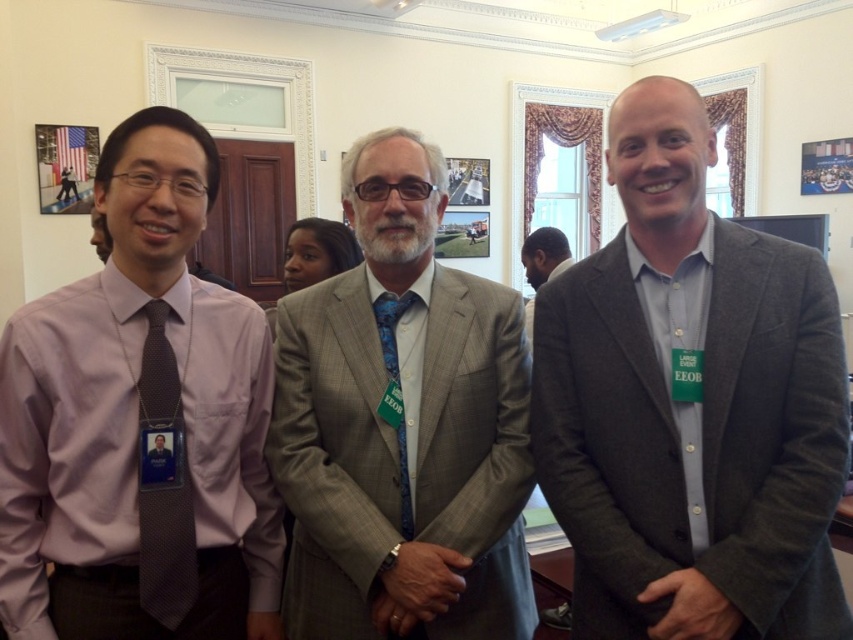
Between purple textured shirt at left and dark gray textured tie at left, which one has less height?

dark gray textured tie at left is shorter.

Can you confirm if purple textured shirt at left is smaller than dark gray textured tie at left?

Actually, purple textured shirt at left might be larger than dark gray textured tie at left.

Locate an element on the screen. The height and width of the screenshot is (640, 853). purple textured shirt at left is located at coordinates (137, 416).

Is the position of gray wool blazer at right less distant than that of silver metallic watch at center?

Yes, it is in front of silver metallic watch at center.

Which is above, gray wool blazer at right or silver metallic watch at center?

gray wool blazer at right

Between point (654, 364) and point (389, 588), which one is positioned behind?

Point (654, 364)

You are a GUI agent. You are given a task and a screenshot of the screen. Output one action in this format:
    pyautogui.click(x=<x>, y=<y>)
    Task: Click on the gray wool blazer at right
    This screenshot has height=640, width=853.
    Given the screenshot: What is the action you would take?
    pyautogui.click(x=689, y=401)

The width and height of the screenshot is (853, 640). In order to click on blue silk tie at center in this screenshot , I will do `click(390, 330)`.

Is point (398, 372) positioned after point (552, 257)?

No, (398, 372) is in front of (552, 257).

At what (x,y) coordinates should I click in order to perform the action: click on blue silk tie at center. Please return your answer as a coordinate pair (x, y). Looking at the image, I should click on (390, 330).